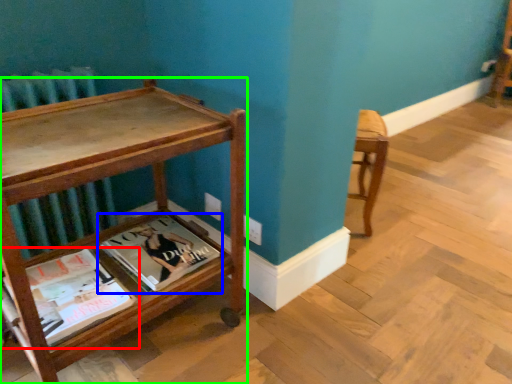
Question: Which object is the closest to the book (highlighted by a red box)? Choose among these: book (highlighted by a blue box) or table (highlighted by a green box).

Choices:
 (A) book
 (B) table

Answer: (A)